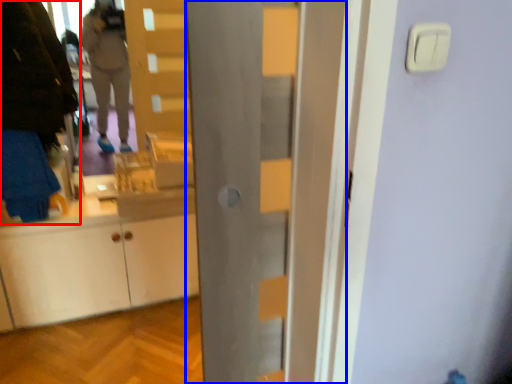
Question: Which of the following is the closest to the observer, person (highlighted by a red box) or door (highlighted by a blue box)?

Choices:
 (A) person
 (B) door

Answer: (B)